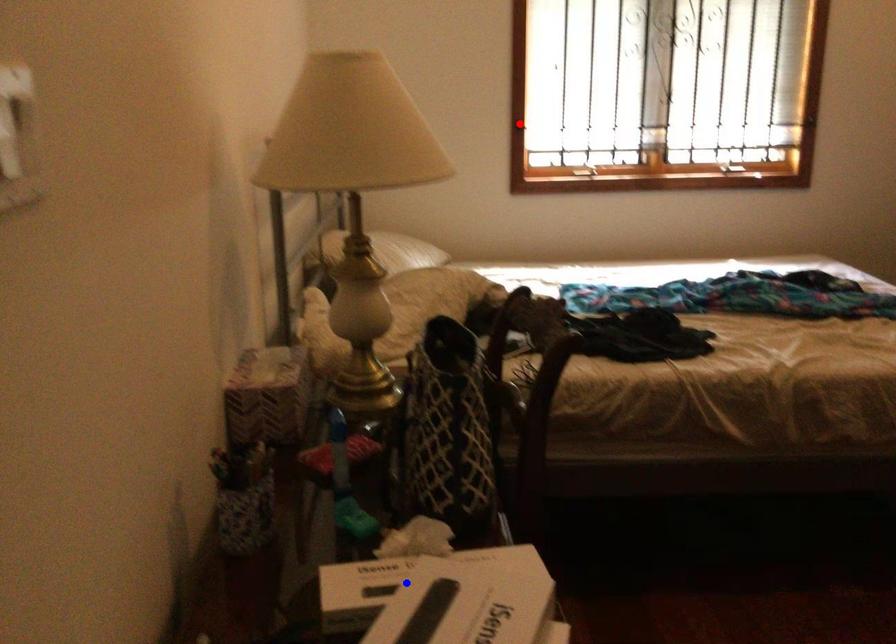
Question: Two points are marked on the image. Which point is closer to the camera?

Choices:
 (A) Blue point is closer.
 (B) Red point is closer.

Answer: (A)